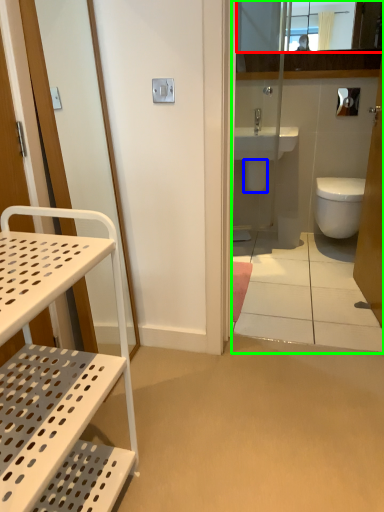
Question: Considering the real-world distances, which object is farthest from mirror (highlighted by a red box)? bidet (highlighted by a blue box) or corridor (highlighted by a green box)?

Choices:
 (A) bidet
 (B) corridor

Answer: (A)